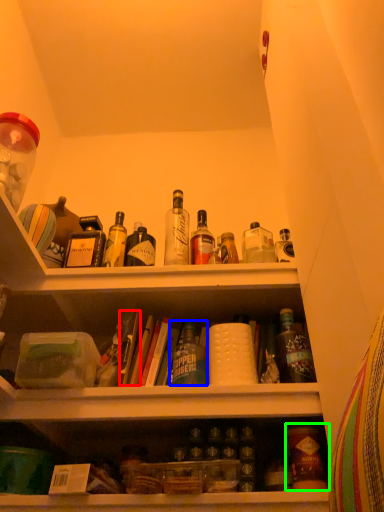
Question: Considering the real-world distances, which object is closest to book (highlighted by a red box)? bottle (highlighted by a blue box) or bottle (highlighted by a green box).

Choices:
 (A) bottle
 (B) bottle

Answer: (A)